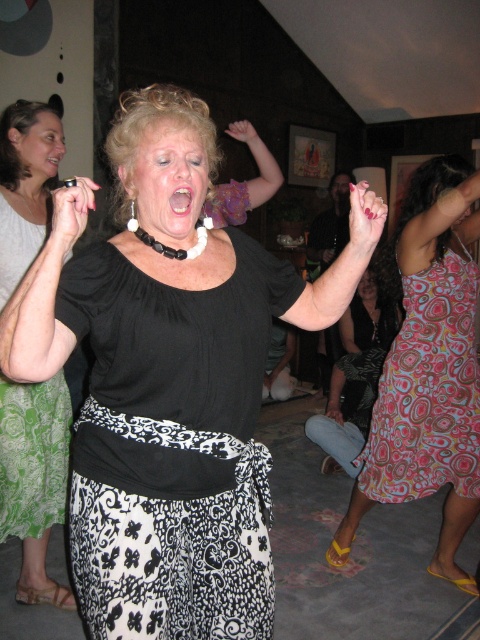
Question: Which point appears closest to the camera in this image?

Choices:
 (A) (12, 310)
 (B) (168, 532)

Answer: (A)

Question: Where is black matte skirt at center located in relation to multicolored patterned dress at right in the image?

Choices:
 (A) below
 (B) above

Answer: (A)

Question: Is black matte skirt at center above pink glossy lips at center?

Choices:
 (A) yes
 (B) no

Answer: (B)

Question: Which of the following is the farthest from the observer?

Choices:
 (A) (351, 531)
 (B) (228, 620)
 (C) (375, 353)

Answer: (C)

Question: Which is nearer to the black satin dress at center?

Choices:
 (A) printed fabric dress at center
 (B) black matte blouse at center
 (C) black textured dress at center

Answer: (C)

Question: Does printed fabric dress at center lie behind pink glossy lips at center?

Choices:
 (A) yes
 (B) no

Answer: (A)